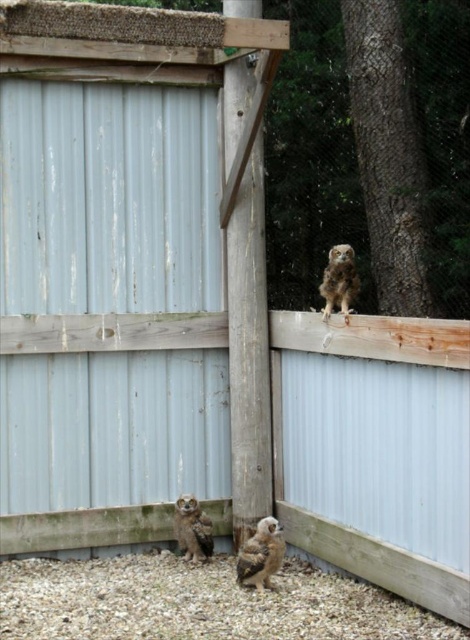
You are a wildlife photographer trying to capture a photo of both the brown speckled feathers owl at lower center and the brown fuzzy owl at lower center. You need to position your camera so that both owls are fully visible in the frame. Which owl should you place closer to the edge of the frame to ensure the entire owl fits without cropping?

You should place the brown speckled feathers owl at lower center closer to the edge of the frame because it might be wider than the brown fuzzy owl at lower center, requiring more space to fit entirely in the photo.

You are a caretaker at the sanctuary and need to place a small food dish for the brown speckled feathers owl at lower center. The dish must be placed on the brown gravel at lower center. Based on the scene description, where should you position the dish relative to the owl?

The brown gravel at lower center is to the left of the brown speckled feathers owl at lower center. Therefore, you should place the dish on the gravel to the left of the owl.